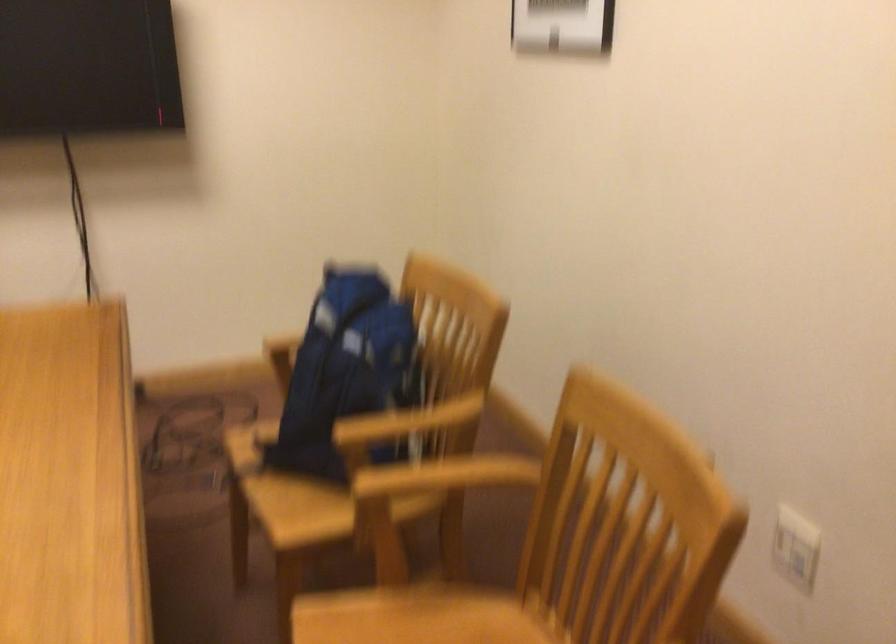
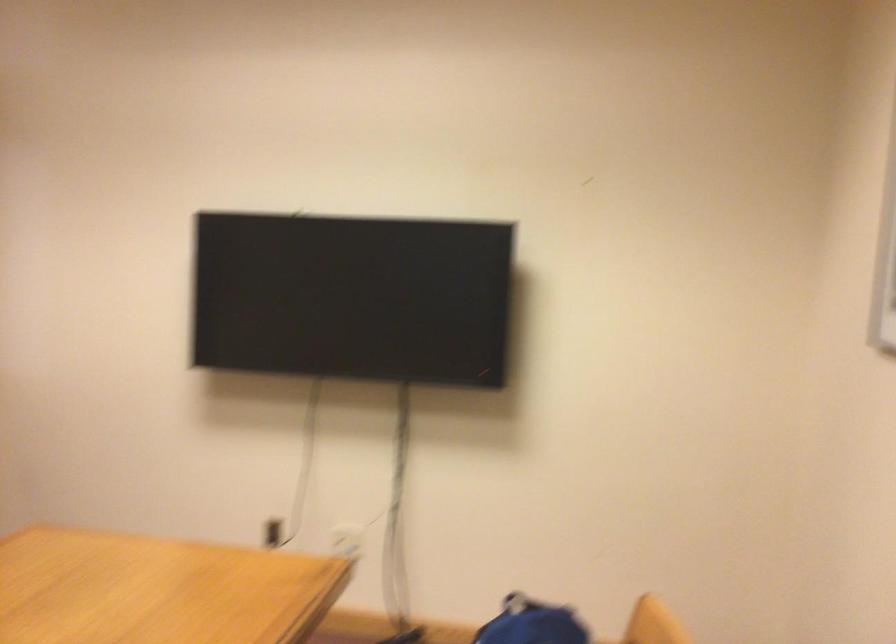
Question: The camera is either moving clockwise (left) or counter-clockwise (right) around the object. The first image is from the beginning of the video and the second image is from the end. Is the camera moving left or right when shooting the video?

Choices:
 (A) Left
 (B) Right

Answer: (B)